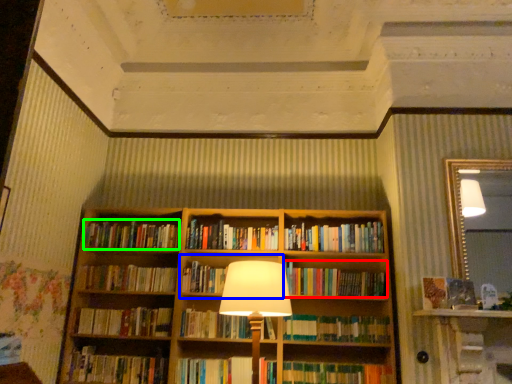
Question: Considering the real-world distances, which object is closest to book (highlighted by a red box)? cabinet (highlighted by a blue box) or book (highlighted by a green box).

Choices:
 (A) cabinet
 (B) book

Answer: (A)